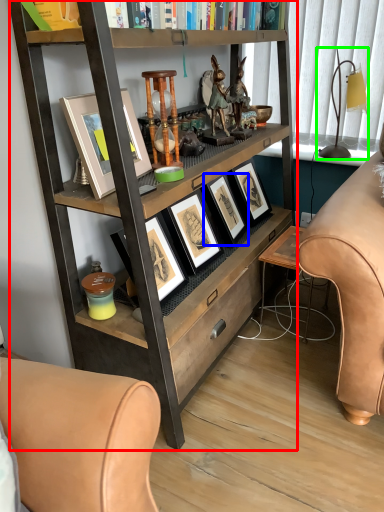
Question: Based on their relative distances, which object is nearer to bookcase (highlighted by a red box)? Choose from picture frame (highlighted by a blue box) and table lamp (highlighted by a green box).

Choices:
 (A) picture frame
 (B) table lamp

Answer: (A)